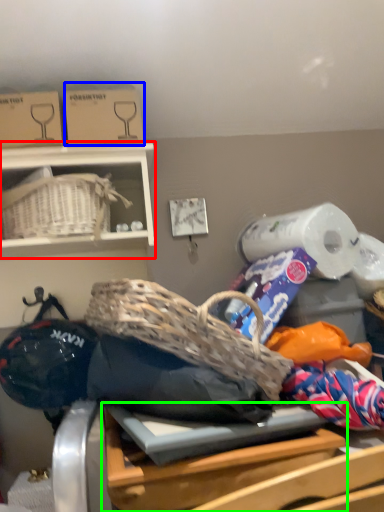
Question: Which object is positioned farthest from furniture (highlighted by a red box)? Select from cardboard box (highlighted by a blue box) and table (highlighted by a green box).

Choices:
 (A) cardboard box
 (B) table

Answer: (B)